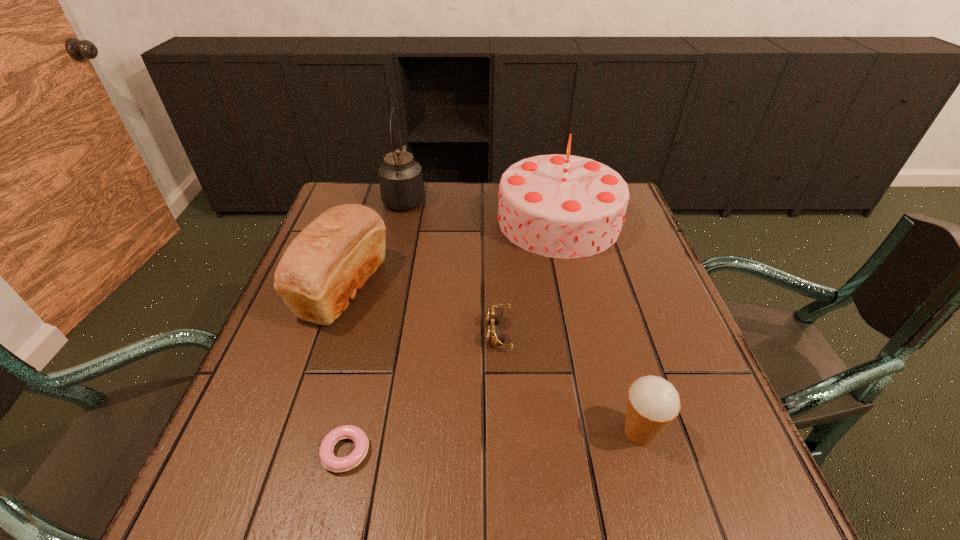
This screenshot has width=960, height=540. In order to click on kettle in this screenshot , I will do `click(401, 180)`.

Locate an element on the screen. The image size is (960, 540). birthday cake is located at coordinates (562, 206).

The height and width of the screenshot is (540, 960). Find the location of `the fourth shortest object`. the fourth shortest object is located at coordinates 331,259.

Where is `the third shortest object`? The image size is (960, 540). the third shortest object is located at coordinates (653, 403).

Where is `goggles`? This screenshot has height=540, width=960. goggles is located at coordinates (495, 333).

Locate an element on the screen. doughnut is located at coordinates (331, 462).

This screenshot has width=960, height=540. I want to click on free space located 0.320m on the left of the birthday cake, so click(x=384, y=220).

Find the location of a particular element. The width and height of the screenshot is (960, 540). vacant space located 0.230m on the front of the bread is located at coordinates (293, 436).

Identify the location of vacant region located on the left of the icecream. This screenshot has height=540, width=960. (587, 432).

Locate an element on the screen. The height and width of the screenshot is (540, 960). free location located 0.240m through the lenses of the fifth tallest object is located at coordinates (373, 332).